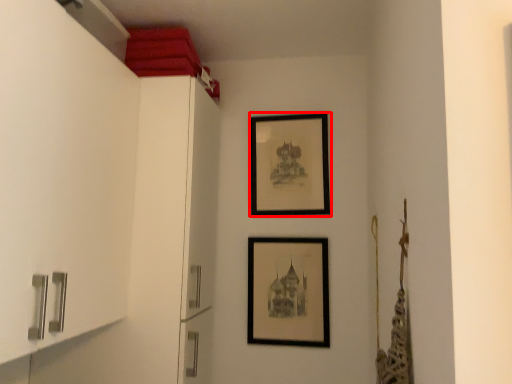
Question: From the image, what is the correct spatial relationship of picture frame (annotated by the red box) in relation to picture frame?

Choices:
 (A) left
 (B) right

Answer: (B)